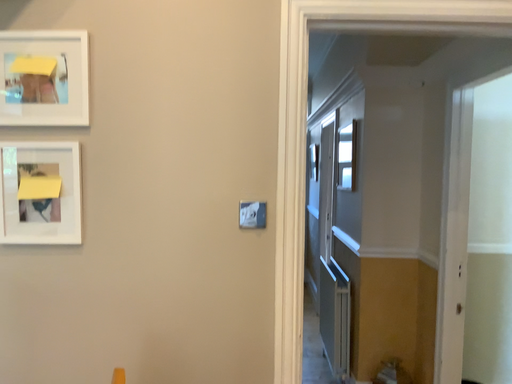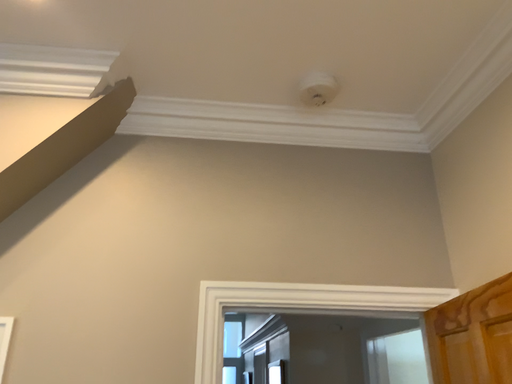
Question: How did the camera likely rotate when shooting the video?

Choices:
 (A) rotated left
 (B) rotated right

Answer: (B)